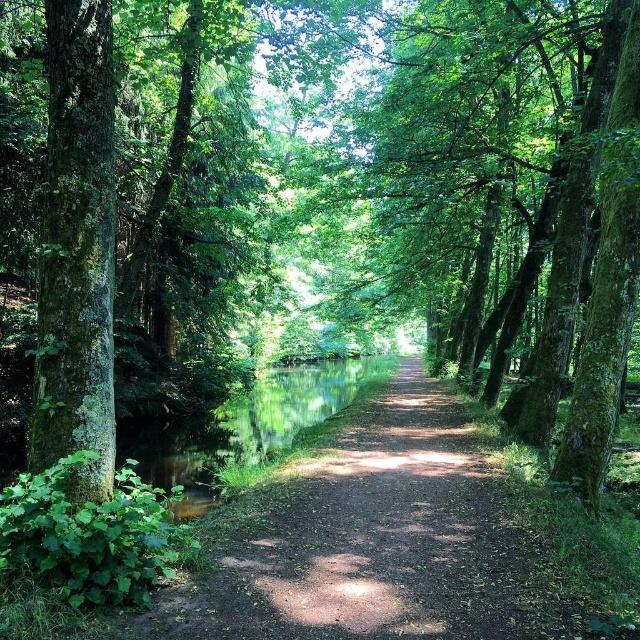
Question: Which point is farther from the camera taking this photo?

Choices:
 (A) (387, 422)
 (B) (77, 376)

Answer: (A)

Question: Does dirt path at center lie in front of green mossy tree at left?

Choices:
 (A) yes
 (B) no

Answer: (A)

Question: Which point is farther from the camera taking this photo?

Choices:
 (A) (465, 593)
 (B) (100, 451)

Answer: (A)

Question: Can you confirm if dirt path at center is bigger than green mossy tree at left?

Choices:
 (A) yes
 (B) no

Answer: (A)

Question: Can you confirm if dirt path at center is positioned to the right of green mossy tree at left?

Choices:
 (A) no
 (B) yes

Answer: (B)